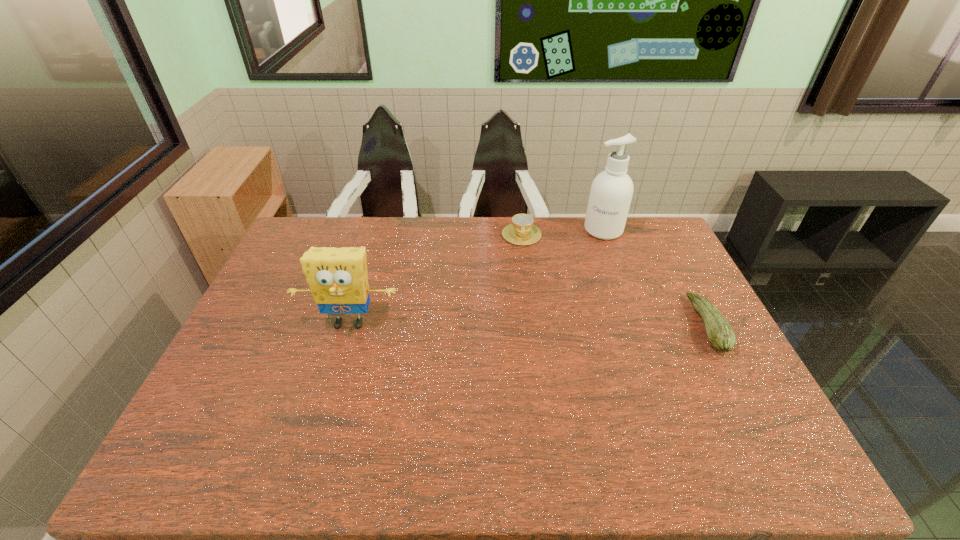
Image resolution: width=960 pixels, height=540 pixels. Find the location of `cleansing agent positioned at the right edge`. cleansing agent positioned at the right edge is located at coordinates (611, 192).

Locate an element on the screen. This screenshot has width=960, height=540. object that is positioned at the far right corner is located at coordinates click(611, 192).

In the image, there is a desktop. Identify the location of vacant space at the far edge. The height and width of the screenshot is (540, 960). [573, 217].

Find the location of a particular element. vacant space at the near edge of the desktop is located at coordinates (550, 415).

The height and width of the screenshot is (540, 960). In order to click on free space at the right edge of the desktop in this screenshot , I will do `click(660, 276)`.

Find the location of a particular element. free location at the far left corner of the desktop is located at coordinates (322, 232).

Where is `vacant point at the far right corner`? This screenshot has height=540, width=960. vacant point at the far right corner is located at coordinates (644, 228).

Find the location of a particular element. This screenshot has width=960, height=540. empty space between the third shortest object and the tallest object is located at coordinates (476, 276).

At what (x,y) coordinates should I click in order to perform the action: click on empty location between the second tallest object and the zucchini. Please return your answer as a coordinate pair (x, y). Looking at the image, I should click on tap(528, 324).

This screenshot has height=540, width=960. Identify the location of vacant area that lies between the rightmost object and the cup. (614, 280).